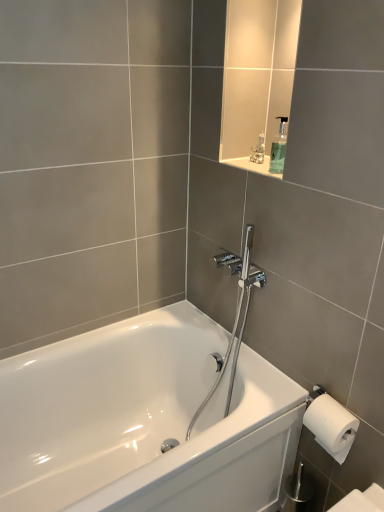
Question: Considering the relative positions of metallic silver figurine at upper center and transparent plastic soap dispenser at upper center in the image provided, is metallic silver figurine at upper center behind transparent plastic soap dispenser at upper center?

Choices:
 (A) yes
 (B) no

Answer: (A)

Question: Is metallic silver figurine at upper center positioned beyond the bounds of transparent plastic soap dispenser at upper center?

Choices:
 (A) no
 (B) yes

Answer: (B)

Question: Is metallic silver figurine at upper center bigger than transparent plastic soap dispenser at upper center?

Choices:
 (A) yes
 (B) no

Answer: (B)

Question: Can you confirm if metallic silver figurine at upper center is wider than transparent plastic soap dispenser at upper center?

Choices:
 (A) no
 (B) yes

Answer: (A)

Question: Is metallic silver figurine at upper center facing away from transparent plastic soap dispenser at upper center?

Choices:
 (A) no
 (B) yes

Answer: (A)

Question: Is transparent plastic soap dispenser at upper center inside the boundaries of polished chrome shower head at center, or outside?

Choices:
 (A) outside
 (B) inside

Answer: (A)

Question: Considering the positions of point (281, 159) and point (228, 347), is point (281, 159) closer or farther from the camera than point (228, 347)?

Choices:
 (A) closer
 (B) farther

Answer: (A)

Question: In terms of width, does transparent plastic soap dispenser at upper center look wider or thinner when compared to polished chrome shower head at center?

Choices:
 (A) wide
 (B) thin

Answer: (B)

Question: Relative to polished chrome shower head at center, is transparent plastic soap dispenser at upper center in front or behind?

Choices:
 (A) front
 (B) behind

Answer: (B)

Question: From a real-world perspective, is metallic silver figurine at upper center above or below white glossy bathtub at center?

Choices:
 (A) below
 (B) above

Answer: (B)

Question: Which is correct: metallic silver figurine at upper center is inside white glossy bathtub at center, or outside of it?

Choices:
 (A) inside
 (B) outside

Answer: (B)

Question: From the image's perspective, is metallic silver figurine at upper center above or below white glossy bathtub at center?

Choices:
 (A) below
 (B) above

Answer: (B)

Question: Would you say metallic silver figurine at upper center is to the left or to the right of white glossy bathtub at center in the picture?

Choices:
 (A) right
 (B) left

Answer: (A)

Question: From a real-world perspective, is polished chrome shower head at center above or below metallic silver figurine at upper center?

Choices:
 (A) above
 (B) below

Answer: (B)

Question: Considering the positions of polished chrome shower head at center and metallic silver figurine at upper center in the image, is polished chrome shower head at center wider or thinner than metallic silver figurine at upper center?

Choices:
 (A) thin
 (B) wide

Answer: (B)